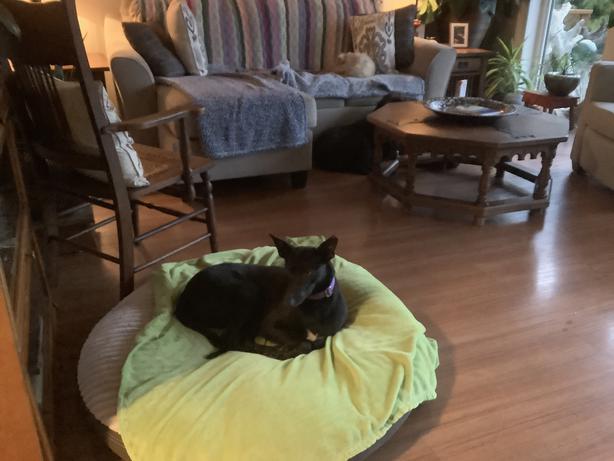
You are a GUI agent. You are given a task and a screenshot of the screen. Output one action in this format:
    pyautogui.click(x=<x>, y=<y>)
    Task: Click on the wall
    The image size is (614, 461).
    Given the screenshot: What is the action you would take?
    pyautogui.click(x=91, y=8)